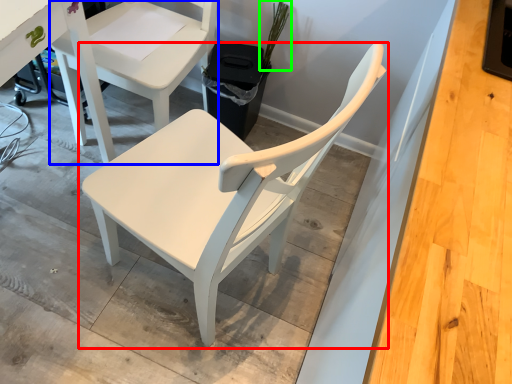
Question: Which object is the farthest from chair (highlighted by a red box)? Choose among these: chair (highlighted by a blue box) or plant (highlighted by a green box).

Choices:
 (A) chair
 (B) plant

Answer: (B)